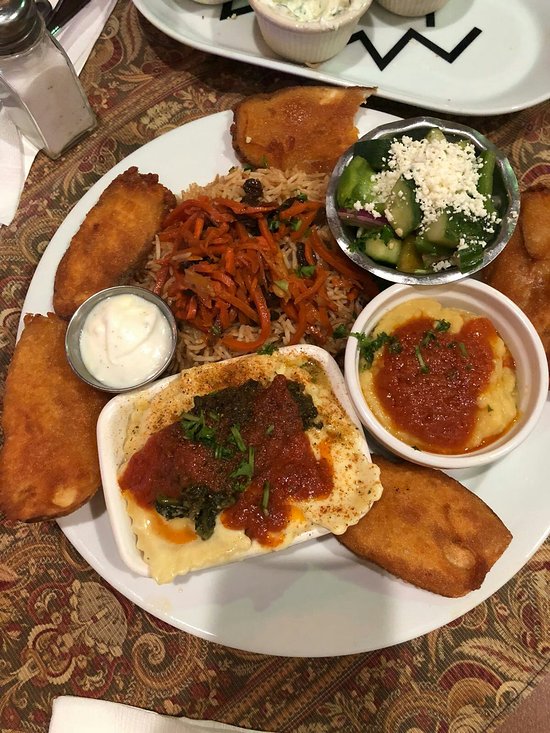
Identify the location of white circular dish. (531, 361).